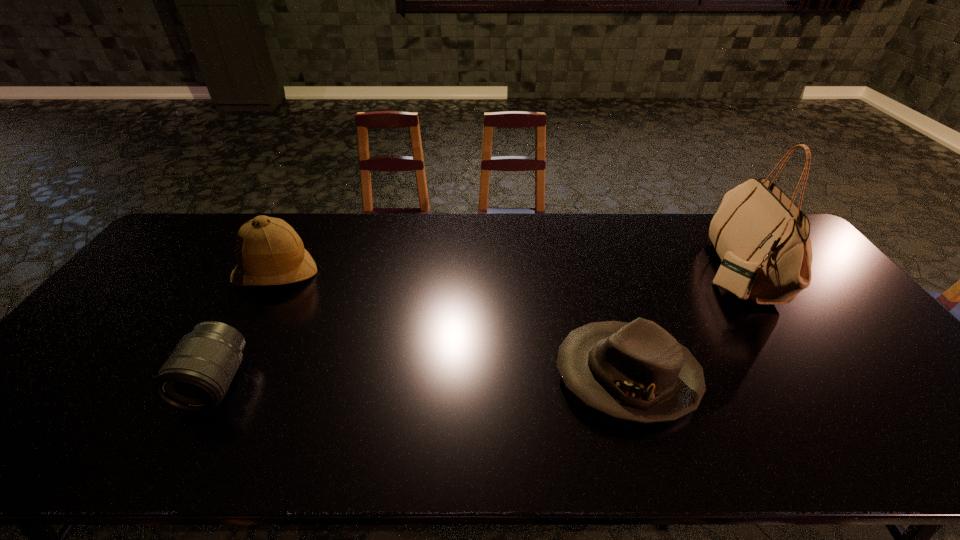
Locate an element on the screen. The image size is (960, 540). vacant space positioned on the front-facing side of the third shortest object is located at coordinates (241, 337).

I want to click on free space located 0.050m on the surface of the telephoto lens, so click(188, 435).

Find the location of `blank space located on the decorative side of the third object from left to right`. blank space located on the decorative side of the third object from left to right is located at coordinates (486, 375).

The image size is (960, 540). Identify the location of vacant area situated 0.350m on the decorative side of the third object from left to right. pos(412,375).

The height and width of the screenshot is (540, 960). Identify the location of blank space located 0.280m on the decorative side of the third object from left to right. (441, 375).

Identify the location of handbag at the far edge. (762, 237).

Where is `hat situated at the far edge`? This screenshot has width=960, height=540. hat situated at the far edge is located at coordinates (268, 250).

I want to click on object that is positioned at the near edge, so click(637, 371).

This screenshot has height=540, width=960. What are the coordinates of `object present at the right edge` in the screenshot? It's located at (762, 237).

Find the location of `object situated at the far right corner`. object situated at the far right corner is located at coordinates (762, 237).